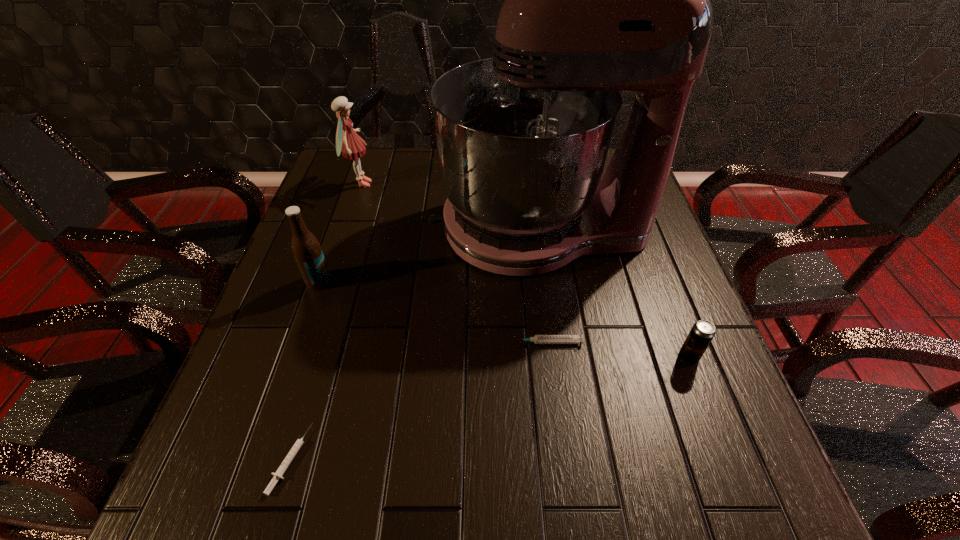
Locate an element on the screen. vacant space at the left edge is located at coordinates (284, 368).

The width and height of the screenshot is (960, 540). In the image, there is a desktop. Identify the location of vacant space at the right edge. (646, 261).

The height and width of the screenshot is (540, 960). I want to click on empty space that is in between the nearest object and the second tallest object, so (325, 321).

Locate an element on the screen. The height and width of the screenshot is (540, 960). vacant area between the tallest object and the beer can is located at coordinates (613, 292).

At what (x,y) coordinates should I click in order to perform the action: click on vacant space that is in between the left syringe and the fifth shortest object. Please return your answer as a coordinate pair (x, y). Looking at the image, I should click on (325, 321).

Locate an element on the screen. The height and width of the screenshot is (540, 960). vacant region between the doll and the right syringe is located at coordinates (453, 263).

This screenshot has height=540, width=960. In order to click on free space that is in between the second tallest object and the nearest object in this screenshot , I will do `click(325, 321)`.

Locate an element on the screen. free space between the shorter syringe and the third shortest object is located at coordinates (490, 408).

The width and height of the screenshot is (960, 540). I want to click on vacant region between the beer bottle and the taller syringe, so click(432, 312).

Where is `vacant space that is in between the right syringe and the fourth shortest object`? vacant space that is in between the right syringe and the fourth shortest object is located at coordinates (432, 312).